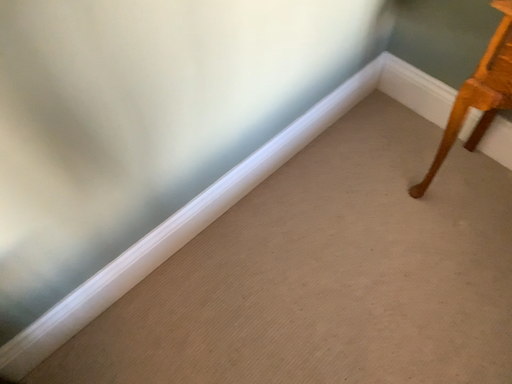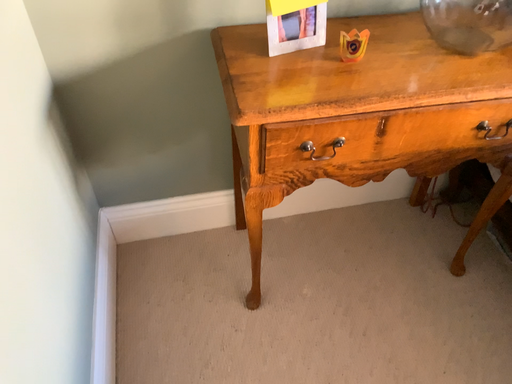
Question: Which way did the camera rotate in the video?

Choices:
 (A) rotated upward
 (B) rotated downward

Answer: (A)